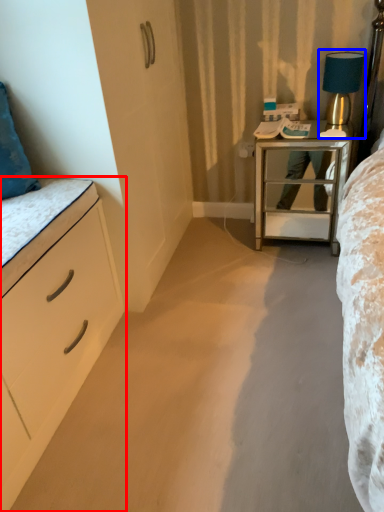
Question: Which object is further to the camera taking this photo, chest of drawers (highlighted by a red box) or bedside lamp (highlighted by a blue box)?

Choices:
 (A) chest of drawers
 (B) bedside lamp

Answer: (B)